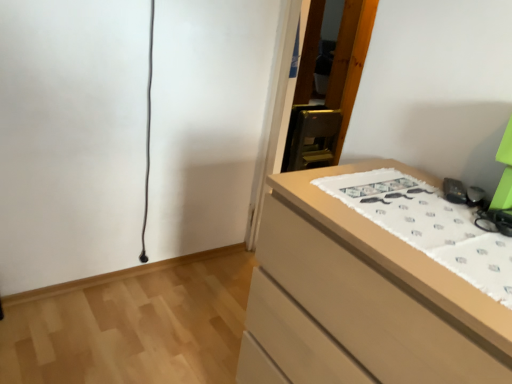
In order to click on white fabric with printed mustaches at right in this screenshot , I will do `click(429, 226)`.

What do you see at coordinates (429, 226) in the screenshot? The height and width of the screenshot is (384, 512). I see `white fabric with printed mustaches at right` at bounding box center [429, 226].

Measure the distance between point (349, 310) and camera.

Point (349, 310) is 87.00 centimeters from camera.

Describe the element at coordinates (360, 299) in the screenshot. I see `matte wood chest of drawers at lower right` at that location.

This screenshot has width=512, height=384. I want to click on matte wood chest of drawers at lower right, so click(360, 299).

In order to click on white fabric with printed mustaches at right in this screenshot , I will do `click(429, 226)`.

Which is more to the left, matte wood chest of drawers at lower right or white fabric with printed mustaches at right?

matte wood chest of drawers at lower right is more to the left.

Based on the photo, which object is further away from the camera, matte wood chest of drawers at lower right or white fabric with printed mustaches at right?

white fabric with printed mustaches at right is further from the camera.

Between point (440, 328) and point (358, 209), which one is positioned in front?

Point (440, 328)

From the image's perspective, is matte wood chest of drawers at lower right on white fabric with printed mustaches at right?

No, from the image's perspective, matte wood chest of drawers at lower right is not over white fabric with printed mustaches at right.

From a real-world perspective, is matte wood chest of drawers at lower right over white fabric with printed mustaches at right?

No, from a real-world perspective, matte wood chest of drawers at lower right is not above white fabric with printed mustaches at right.

Can you confirm if matte wood chest of drawers at lower right is thinner than white fabric with printed mustaches at right?

In fact, matte wood chest of drawers at lower right might be wider than white fabric with printed mustaches at right.

Which of these two, matte wood chest of drawers at lower right or white fabric with printed mustaches at right, stands taller?

Standing taller between the two is matte wood chest of drawers at lower right.

Considering the relative sizes of matte wood chest of drawers at lower right and white fabric with printed mustaches at right in the image provided, is matte wood chest of drawers at lower right smaller than white fabric with printed mustaches at right?

Actually, matte wood chest of drawers at lower right might be larger than white fabric with printed mustaches at right.

Is matte wood chest of drawers at lower right inside the boundaries of white fabric with printed mustaches at right, or outside?

matte wood chest of drawers at lower right is located beyond the bounds of white fabric with printed mustaches at right.

Can you see matte wood chest of drawers at lower right touching white fabric with printed mustaches at right?

No, matte wood chest of drawers at lower right is not making contact with white fabric with printed mustaches at right.

Is matte wood chest of drawers at lower right positioned with its back to white fabric with printed mustaches at right?

matte wood chest of drawers at lower right does not have its back to white fabric with printed mustaches at right.

From the picture: Can you tell me how much matte wood chest of drawers at lower right and white fabric with printed mustaches at right differ in facing direction?

There is a 2.48-degree angle between the facing directions of matte wood chest of drawers at lower right and white fabric with printed mustaches at right.

Locate an element on the screen. Image resolution: width=512 pixels, height=384 pixels. the chest of drawers below the white fabric with printed mustaches at right (from the image's perspective) is located at coordinates (360, 299).

In the image, is white fabric with printed mustaches at right on the left side or the right side of matte wood chest of drawers at lower right?

white fabric with printed mustaches at right is to the right of matte wood chest of drawers at lower right.

Considering the positions of objects white fabric with printed mustaches at right and matte wood chest of drawers at lower right in the image provided, who is behind, white fabric with printed mustaches at right or matte wood chest of drawers at lower right?

white fabric with printed mustaches at right is further away from the camera.

Is point (456, 239) closer or farther from the camera than point (328, 175)?

Point (456, 239) is closer to the camera than point (328, 175).

From the image's perspective, is white fabric with printed mustaches at right located above or below matte wood chest of drawers at lower right?

white fabric with printed mustaches at right is above matte wood chest of drawers at lower right.

From a real-world perspective, is white fabric with printed mustaches at right on top of matte wood chest of drawers at lower right?

Indeed, from a real-world perspective, white fabric with printed mustaches at right stands above matte wood chest of drawers at lower right.

Is white fabric with printed mustaches at right wider than matte wood chest of drawers at lower right?

No, white fabric with printed mustaches at right is not wider than matte wood chest of drawers at lower right.

Considering the relative sizes of white fabric with printed mustaches at right and matte wood chest of drawers at lower right in the image provided, is white fabric with printed mustaches at right shorter than matte wood chest of drawers at lower right?

Yes, white fabric with printed mustaches at right is shorter than matte wood chest of drawers at lower right.

Who is bigger, white fabric with printed mustaches at right or matte wood chest of drawers at lower right?

With larger size is matte wood chest of drawers at lower right.

Do you think white fabric with printed mustaches at right is within matte wood chest of drawers at lower right, or outside of it?

white fabric with printed mustaches at right is located inside matte wood chest of drawers at lower right.

Are white fabric with printed mustaches at right and matte wood chest of drawers at lower right making contact?

No, white fabric with printed mustaches at right is not in contact with matte wood chest of drawers at lower right.

Could you tell me if white fabric with printed mustaches at right is facing matte wood chest of drawers at lower right?

Yes, white fabric with printed mustaches at right is turned towards matte wood chest of drawers at lower right.

This screenshot has height=384, width=512. In the image, there is a white fabric with printed mustaches at right. Find the location of `the chest of drawers below it (from a real-world perspective)`. the chest of drawers below it (from a real-world perspective) is located at coordinates (360, 299).

The image size is (512, 384). I want to click on sheet on the right of matte wood chest of drawers at lower right, so coord(429,226).

Image resolution: width=512 pixels, height=384 pixels. Find the location of `sheet above the matte wood chest of drawers at lower right (from the image's perspective)`. sheet above the matte wood chest of drawers at lower right (from the image's perspective) is located at coordinates (429, 226).